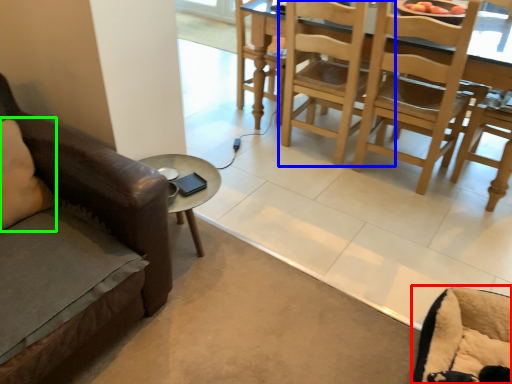
Question: Based on their relative distances, which object is farther from swivel chair (highlighted by a red box)? Choose from chair (highlighted by a blue box) and pillow (highlighted by a green box).

Choices:
 (A) chair
 (B) pillow

Answer: (B)